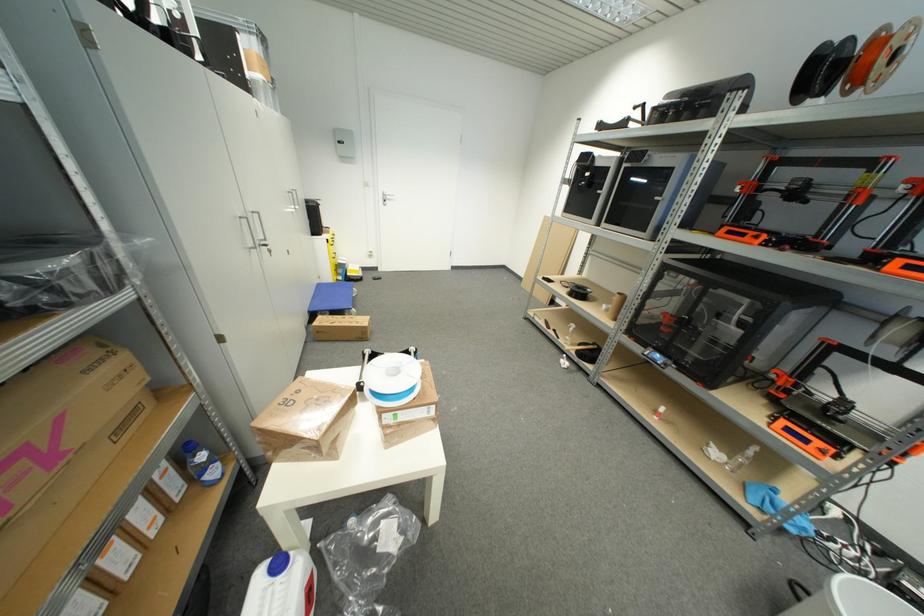
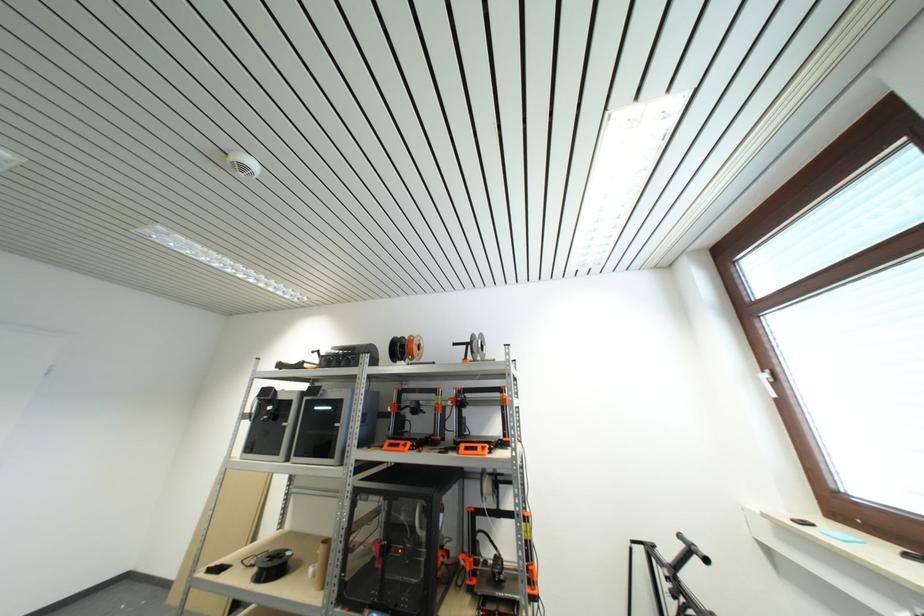
In the second image, find the point that corresponds to point (886, 63) in the first image.

(419, 352)